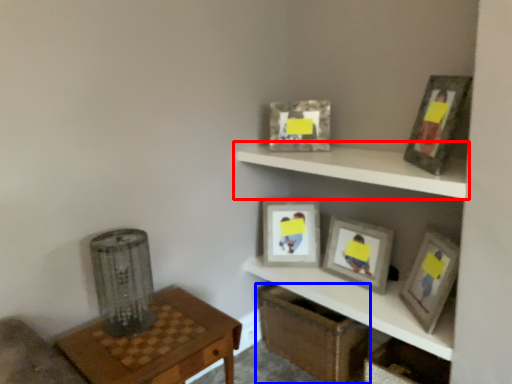
Question: Which object appears farthest to the camera in this image, shelf (highlighted by a red box) or crate (highlighted by a blue box)?

Choices:
 (A) shelf
 (B) crate

Answer: (B)